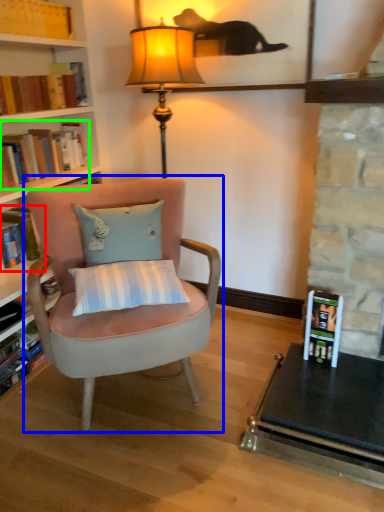
Question: Which object is the farthest from book (highlighted by a red box)? Choose among these: chair (highlighted by a blue box) or book (highlighted by a green box).

Choices:
 (A) chair
 (B) book

Answer: (A)